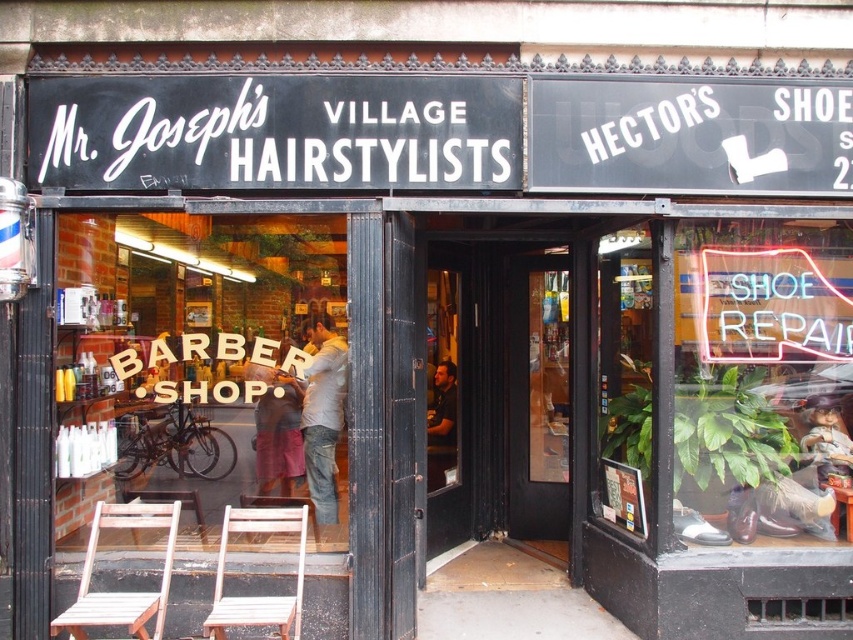
You are a customer standing at the entrance of the barbershop. You notice two items at the center of the store. Which item is closer to you between the dark gray fabric shirt at center and the matte plastic doll at center?

The dark gray fabric shirt at center is closer to the viewer than the matte plastic doll at center, so the dark gray fabric shirt at center is closer to you.